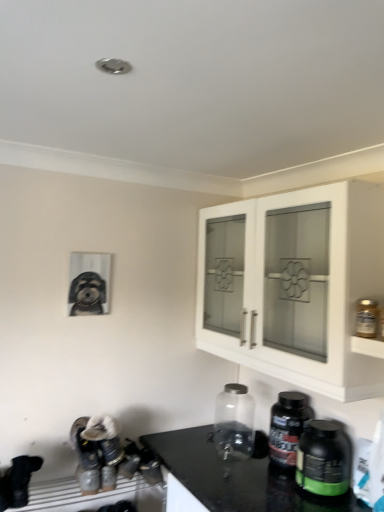
Question: From the image's perspective, is transparent glass jar at center, acting as the 1th bottle starting from the back, located above or below clear glass jar at upper right, placed as the fourth bottle when sorted from back to front?

Choices:
 (A) below
 (B) above

Answer: (A)

Question: Visually, is transparent glass jar at center, acting as the 1th bottle starting from the back, positioned to the left or to the right of clear glass jar at upper right, the 1th bottle positioned from the front?

Choices:
 (A) left
 (B) right

Answer: (A)

Question: Which of these objects is positioned closest to the clear glass jar at upper right, the 1th bottle positioned from the front?

Choices:
 (A) green matte protein powder container at lower right, the 2th bottle in the front-to-back sequence
 (B) white glass cabinet at upper right
 (C) matte black dog at left
 (D) black plastic bottle at lower right, the 2th bottle from the back
 (E) transparent glass jar at center, the fourth bottle viewed from the front

Answer: (B)

Question: Which object is positioned closest to the green matte protein powder container at lower right, the 3th bottle in the back-to-front sequence?

Choices:
 (A) transparent glass jar at center, acting as the 1th bottle starting from the back
 (B) clear glass jar at upper right, placed as the fourth bottle when sorted from back to front
 (C) black plastic bottle at lower right, the 3th bottle viewed from the front
 (D) white glass cabinet at upper right
 (E) matte black dog at left

Answer: (C)